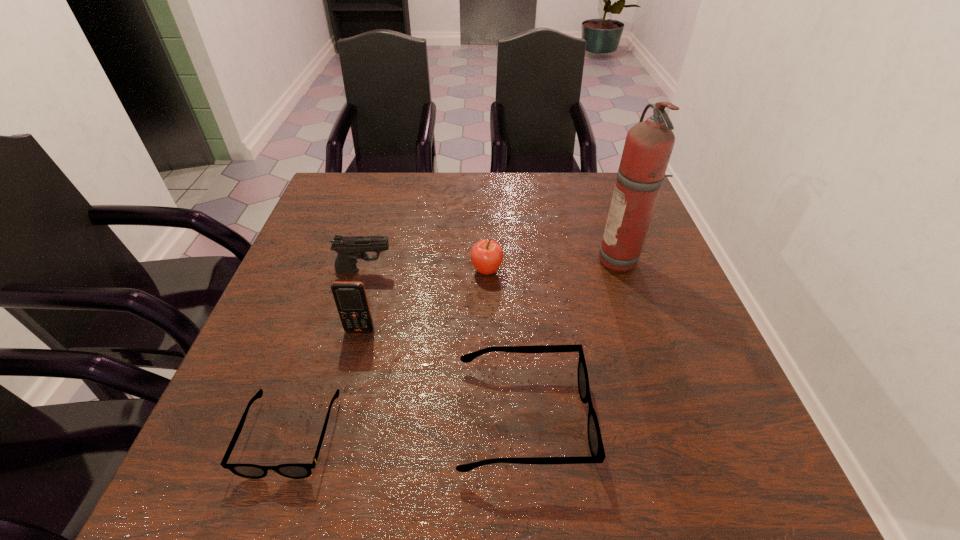
Locate an element on the screen. This screenshot has height=540, width=960. vacant space located on the arms of the second shortest object is located at coordinates (709, 418).

Image resolution: width=960 pixels, height=540 pixels. I want to click on vacant point located at the barrel of the pistol, so click(414, 271).

This screenshot has width=960, height=540. Find the location of `free space located 0.280m on the side of the fire extinguisher with the label and nozzle`. free space located 0.280m on the side of the fire extinguisher with the label and nozzle is located at coordinates (485, 261).

The image size is (960, 540). Identify the location of vacant area situated 0.080m on the side of the fire extinguisher with the label and nozzle. (565, 261).

Locate an element on the screen. Image resolution: width=960 pixels, height=540 pixels. vacant space located 0.340m on the side of the fire extinguisher with the label and nozzle is located at coordinates (461, 261).

Where is `free space located 0.090m on the back of the apple`? free space located 0.090m on the back of the apple is located at coordinates (486, 238).

I want to click on free space located 0.080m on the screen of the second tallest object, so click(x=351, y=365).

Image resolution: width=960 pixels, height=540 pixels. Identify the location of spectacles that is at the left edge. (295, 471).

Where is `pistol at the left edge`? pistol at the left edge is located at coordinates (349, 248).

Locate an element on the screen. object located at the right edge is located at coordinates (648, 146).